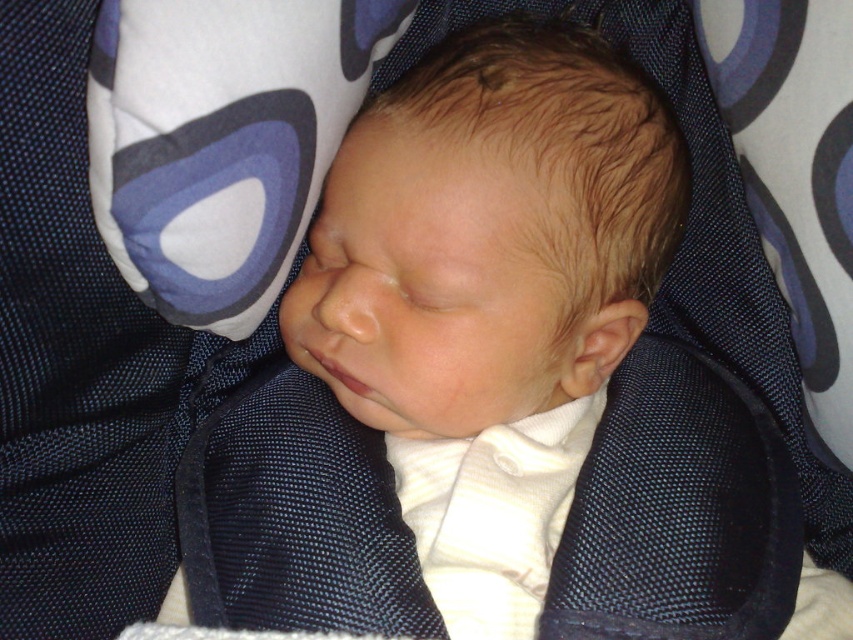
Question: Which point appears closest to the camera in this image?

Choices:
 (A) (524, 342)
 (B) (227, 154)

Answer: (B)

Question: Does smooth white baby at center have a lesser width compared to white fabric pillow at upper center?

Choices:
 (A) no
 (B) yes

Answer: (A)

Question: Is smooth white baby at center positioned in front of white fabric pillow at upper center?

Choices:
 (A) yes
 (B) no

Answer: (B)

Question: Which point is closer to the camera taking this photo?

Choices:
 (A) (404, 221)
 (B) (131, 61)

Answer: (B)

Question: Is smooth white baby at center to the right of white fabric pillow at upper center from the viewer's perspective?

Choices:
 (A) no
 (B) yes

Answer: (B)